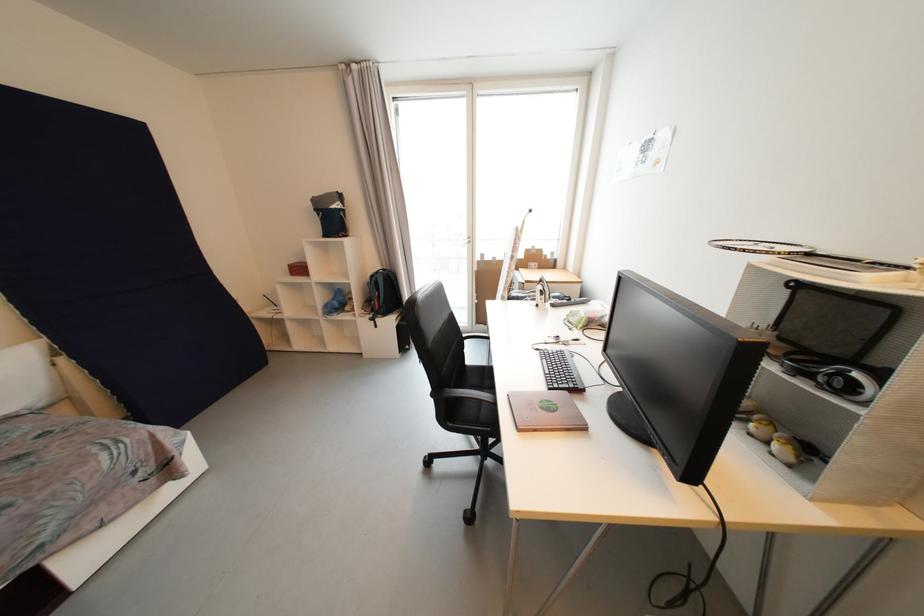
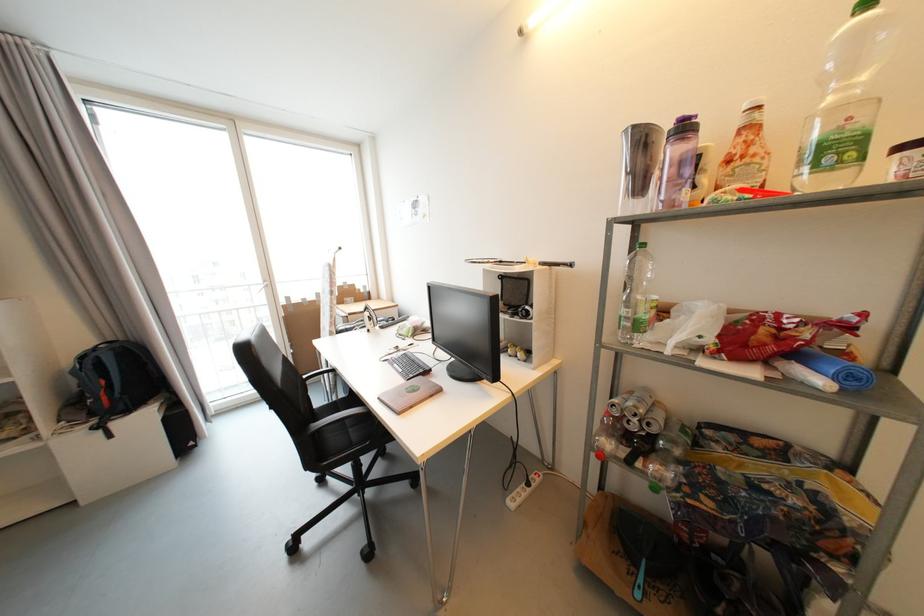
Locate, in the second image, the point that corresponds to [577,387] in the first image.

(427, 373)